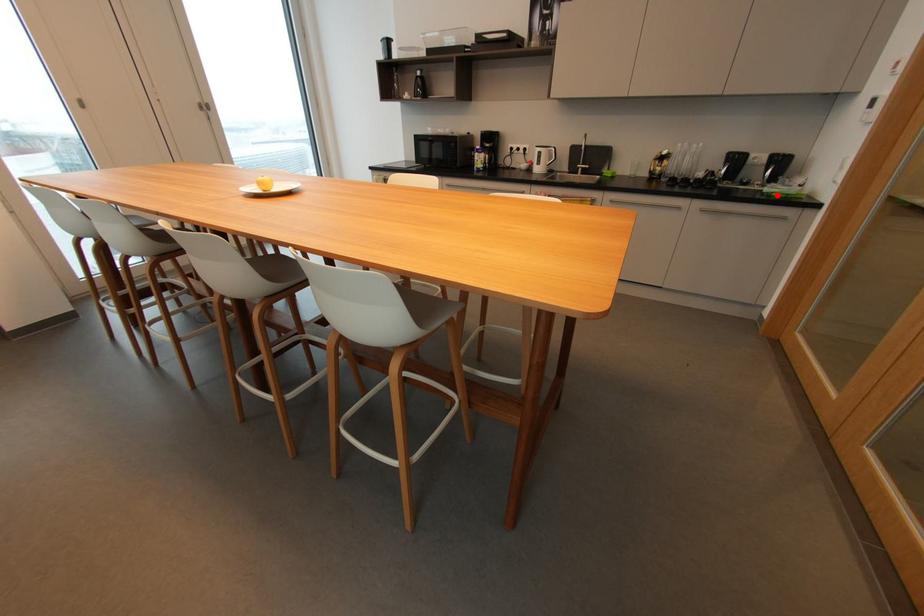
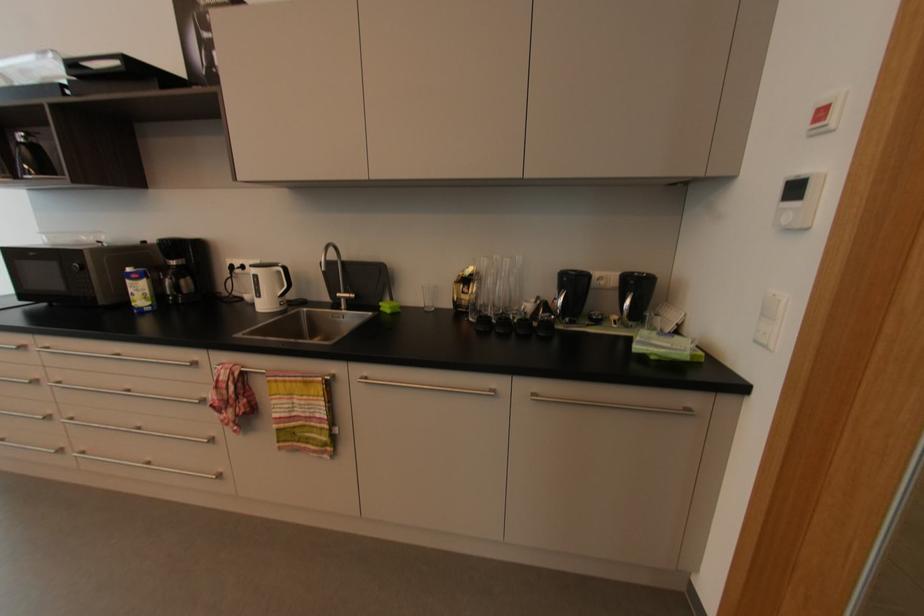
Question: I am providing you with two images of the same scene from different viewpoints. A red point is marked on the first image. At the location where the point appears in image 1, is it still visible in image 2?

Choices:
 (A) Yes
 (B) No

Answer: (A)